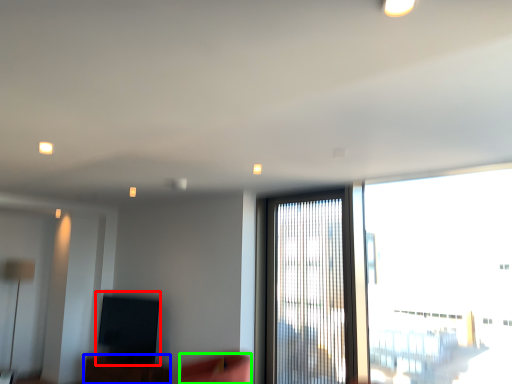
Question: Which is nearer to the window screen (highlighted by a red box)? furniture (highlighted by a blue box) or swivel chair (highlighted by a green box).

Choices:
 (A) furniture
 (B) swivel chair

Answer: (A)